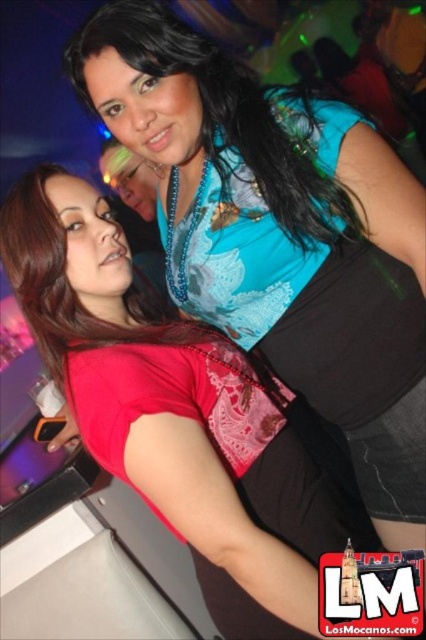
You are a photographer trying to capture a clear shot of both the matte blue blouse at upper center and the matte red shirt at upper left. Which one is positioned to the right of the other?

The matte blue blouse at upper center is positioned on the right side of the matte red shirt at upper left.

You are standing in a nightclub and see the two women described. The first woman is wearing a vibrant red top with intricate patterns on the sleeves and a black skirt. The second woman is wearing a sleeveless blue top with floral designs and a black skirt. Where exactly is the matte blue blouse at upper center located in the image?

The matte blue blouse at upper center is located at point coordinates of (281, 234).

You are a photographer trying to capture a clear shot of both the matte blue blouse at upper center and the matte red shirt at upper left. Which one is positioned lower in the frame?

The matte blue blouse at upper center is located below the matte red shirt at upper left, so it is positioned lower in the frame.